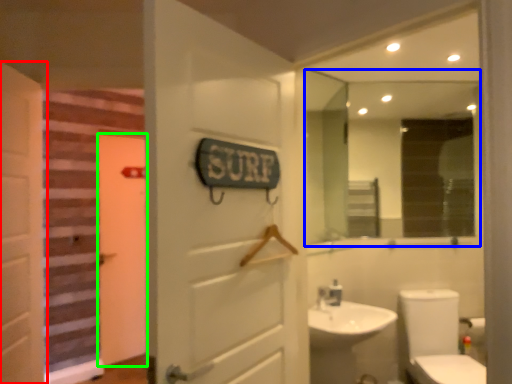
Question: Based on their relative distances, which object is farther from door (highlighted by a red box)? Choose from mirror (highlighted by a blue box) and door (highlighted by a green box).

Choices:
 (A) mirror
 (B) door

Answer: (A)